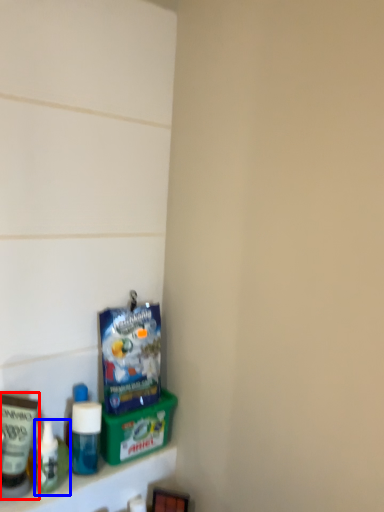
Question: Which object appears farthest to the camera in this image, toiletry (highlighted by a red box) or toiletry (highlighted by a blue box)?

Choices:
 (A) toiletry
 (B) toiletry

Answer: (B)